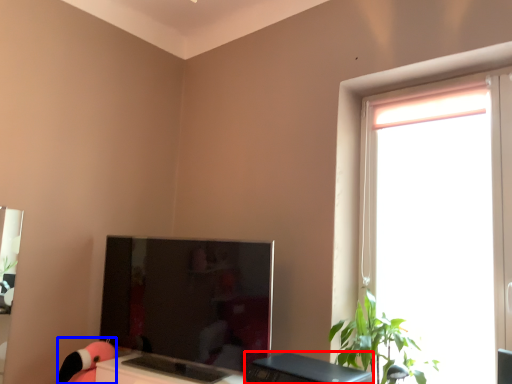
Question: Which point is closer to the camera, desktop (highlighted by a red box) or toy (highlighted by a blue box)?

Choices:
 (A) desktop
 (B) toy

Answer: (A)